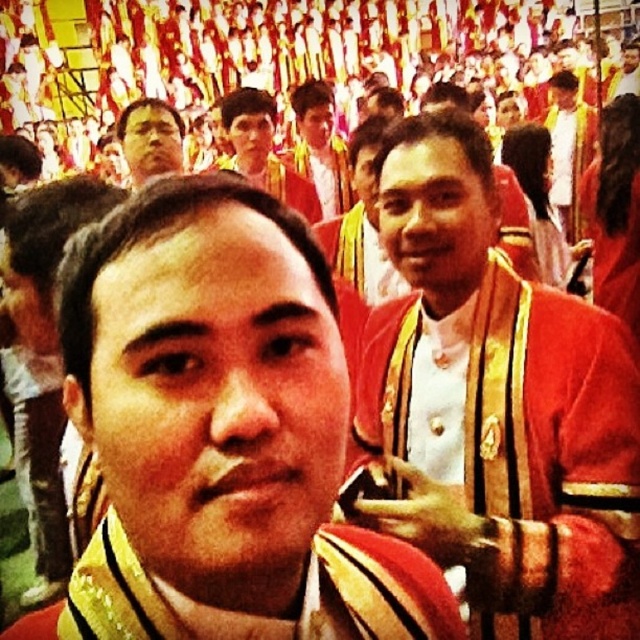
Which is below, shiny red jacket at center or matte gold medal at center?

shiny red jacket at center is lower down.

Is shiny red jacket at center to the left of matte gold medal at center from the viewer's perspective?

In fact, shiny red jacket at center is to the right of matte gold medal at center.

Is point (492, 291) farther from camera compared to point (333, 168)?

No, it is in front of (333, 168).

Locate an element on the screen. The height and width of the screenshot is (640, 640). shiny red jacket at center is located at coordinates (550, 461).

Can you confirm if shiny gold chain at center is positioned to the left of shiny red jacket at center?

Yes, shiny gold chain at center is to the left of shiny red jacket at center.

This screenshot has height=640, width=640. I want to click on shiny gold chain at center, so click(x=221, y=432).

The width and height of the screenshot is (640, 640). Identify the location of shiny gold chain at center. pyautogui.click(x=221, y=432).

Does red velvet sash at center appear on the right side of matte gold medal at center?

Yes, red velvet sash at center is to the right of matte gold medal at center.

Is red velvet sash at center wider than matte gold medal at center?

Correct, the width of red velvet sash at center exceeds that of matte gold medal at center.

Where is `red velvet sash at center`? red velvet sash at center is located at coordinates (372, 589).